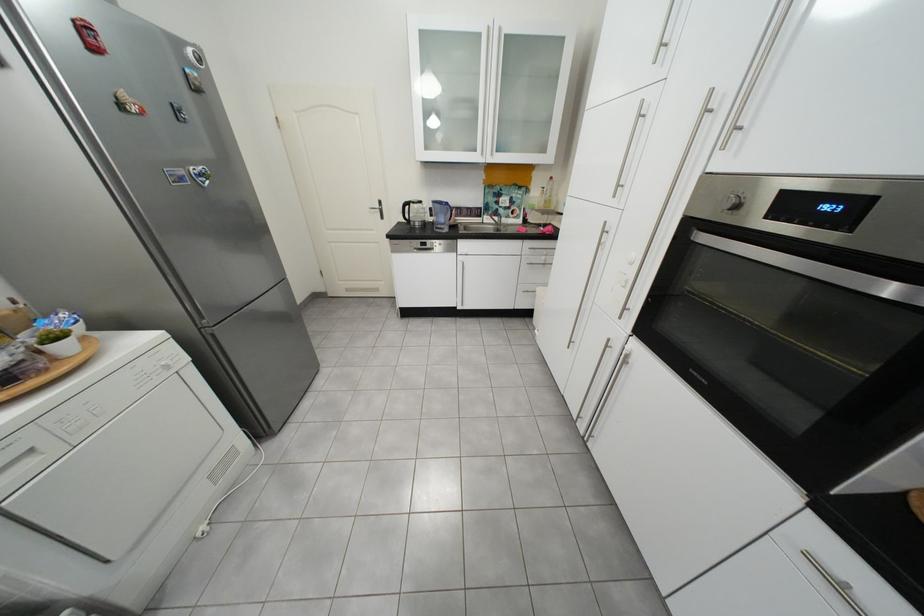
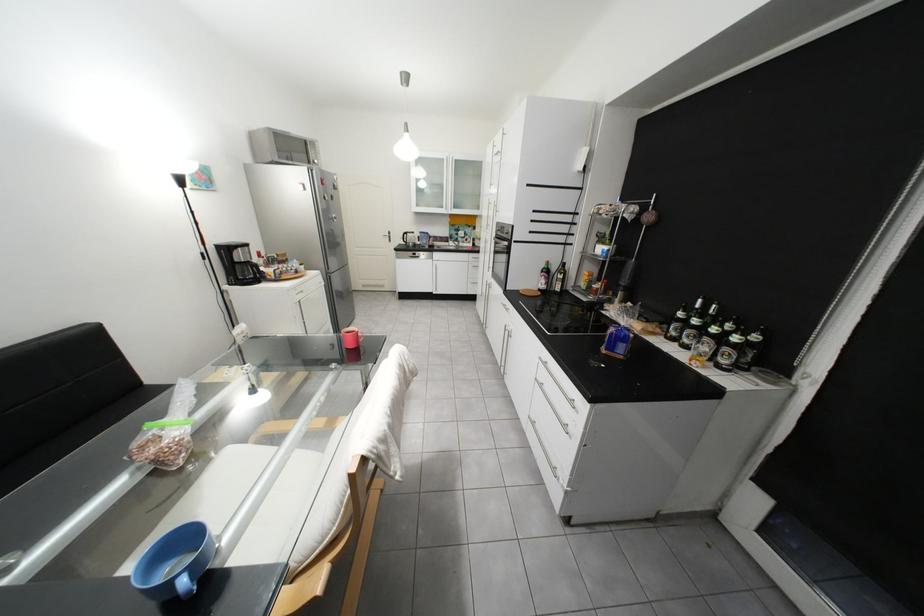
Locate, in the second image, the point that corresponds to pixel 257 445 in the first image.

(343, 331)